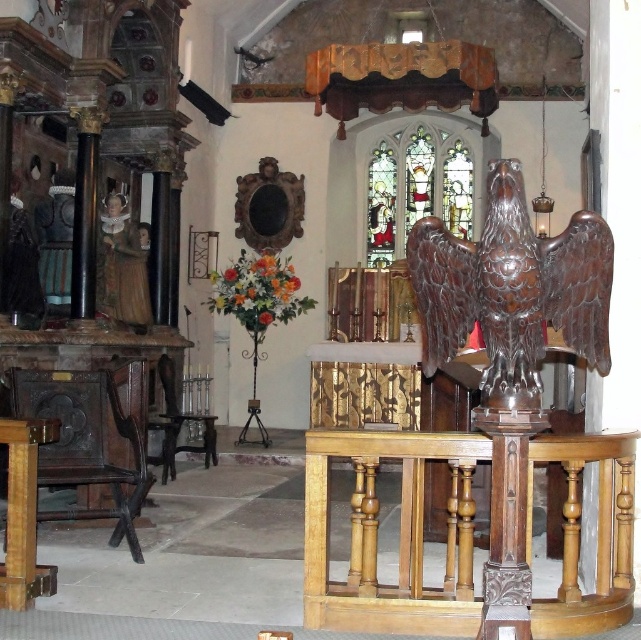
Question: Which point is farther to the camera?

Choices:
 (A) (410, 586)
 (B) (12, 540)
 (C) (499, 209)

Answer: (B)

Question: Which point is closer to the camera?

Choices:
 (A) shiny brown eagle at center
 (B) wooden table at lower left

Answer: (A)

Question: Which object is closer to the camera taking this photo?

Choices:
 (A) shiny brown eagle at center
 (B) wooden table at lower left

Answer: (A)

Question: Can you confirm if light brown polished wood table at center is bigger than shiny brown eagle at center?

Choices:
 (A) yes
 (B) no

Answer: (B)

Question: Can you confirm if shiny brown eagle at center is bigger than wooden table at lower left?

Choices:
 (A) no
 (B) yes

Answer: (B)

Question: Can you confirm if light brown polished wood table at center is thinner than wooden table at lower left?

Choices:
 (A) no
 (B) yes

Answer: (A)